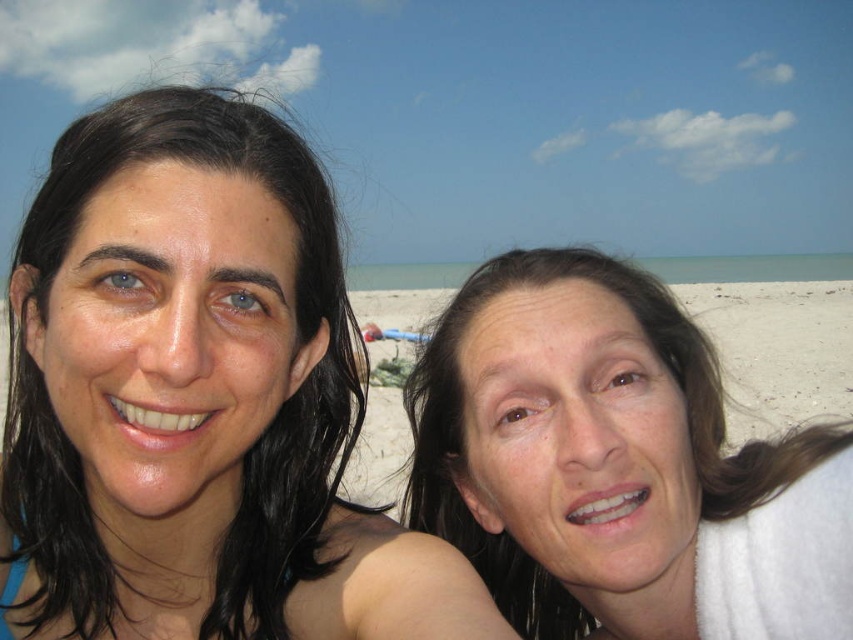
You are a photographer trying to capture a closeup of the smooth skin face at right without including the matte black hair at left in the frame. Based on their positions, is this possible?

The matte black hair at left is located above the smooth skin face at right, so if you position the camera to focus on the smooth skin face at right and avoid the area above it, you can capture the closeup without including the matte black hair at left.

You are a photographer trying to capture the two people in the scene. The matte black hair at left and the smooth skin face at right are your subjects. Since you want to ensure the subjects are well framed, you need to know their relative sizes. Which subject has a smaller width?

The matte black hair at left is thinner than the smooth skin face at right, so the matte black hair at left has a smaller width.